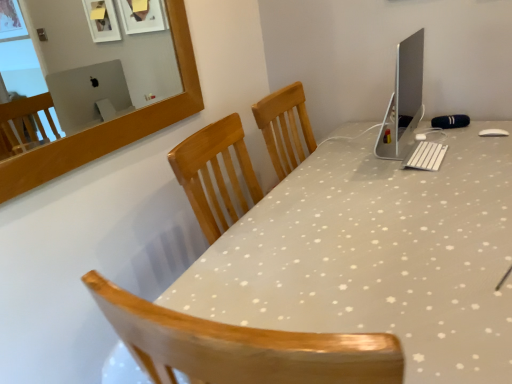
Question: Does white plastic keyboard at center have a greater width compared to sleek silver monitor at upper right?

Choices:
 (A) yes
 (B) no

Answer: (A)

Question: Is white plastic keyboard at center completely or partially outside of sleek silver monitor at upper right?

Choices:
 (A) no
 (B) yes

Answer: (B)

Question: Does white plastic keyboard at center appear on the right side of sleek silver monitor at upper right?

Choices:
 (A) no
 (B) yes

Answer: (B)

Question: Are white plastic keyboard at center and sleek silver monitor at upper right located far from each other?

Choices:
 (A) yes
 (B) no

Answer: (B)

Question: Could sleek silver monitor at upper right be considered to be inside white plastic keyboard at center?

Choices:
 (A) yes
 (B) no

Answer: (B)

Question: In terms of width, does sleek silver monitor at upper right look wider or thinner when compared to white glossy desk at center?

Choices:
 (A) thin
 (B) wide

Answer: (A)

Question: From a real-world perspective, is sleek silver monitor at upper right above or below white glossy desk at center?

Choices:
 (A) below
 (B) above

Answer: (B)

Question: Considering the positions of sleek silver monitor at upper right and white glossy desk at center in the image, is sleek silver monitor at upper right taller or shorter than white glossy desk at center?

Choices:
 (A) short
 (B) tall

Answer: (A)

Question: From the image's perspective, is sleek silver monitor at upper right positioned above or below white glossy desk at center?

Choices:
 (A) below
 (B) above

Answer: (B)

Question: In terms of width, does white plastic keyboard at center look wider or thinner when compared to white glossy desk at center?

Choices:
 (A) thin
 (B) wide

Answer: (A)

Question: From the image's perspective, is white plastic keyboard at center located above or below white glossy desk at center?

Choices:
 (A) below
 (B) above

Answer: (B)

Question: Considering their positions, is white plastic keyboard at center located in front of or behind white glossy desk at center?

Choices:
 (A) front
 (B) behind

Answer: (B)

Question: Is white plastic keyboard at center taller or shorter than white glossy desk at center?

Choices:
 (A) short
 (B) tall

Answer: (A)

Question: In terms of width, does white plastic keyboard at center look wider or thinner when compared to sleek silver monitor at upper right?

Choices:
 (A) thin
 (B) wide

Answer: (B)

Question: From the image's perspective, is white plastic keyboard at center located above or below sleek silver monitor at upper right?

Choices:
 (A) above
 (B) below

Answer: (B)